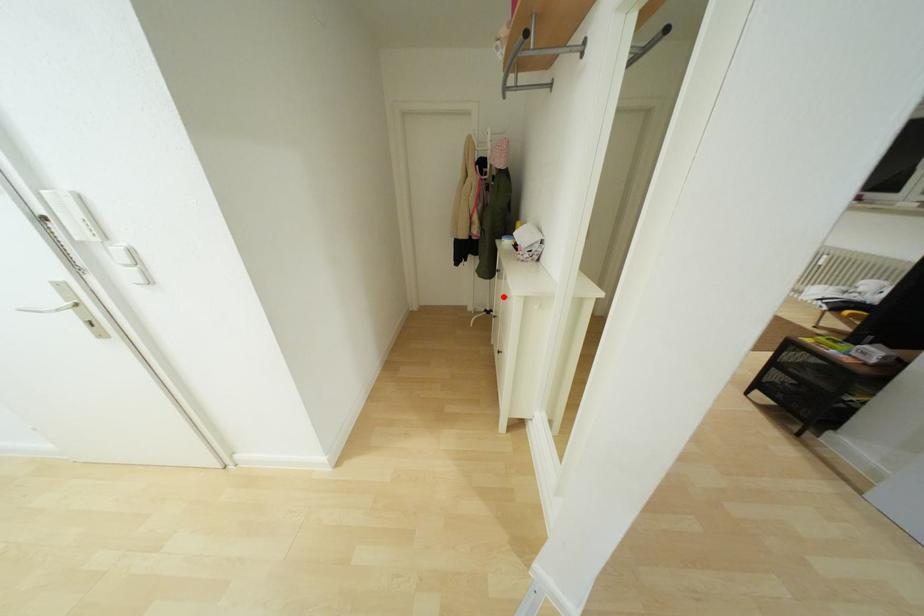
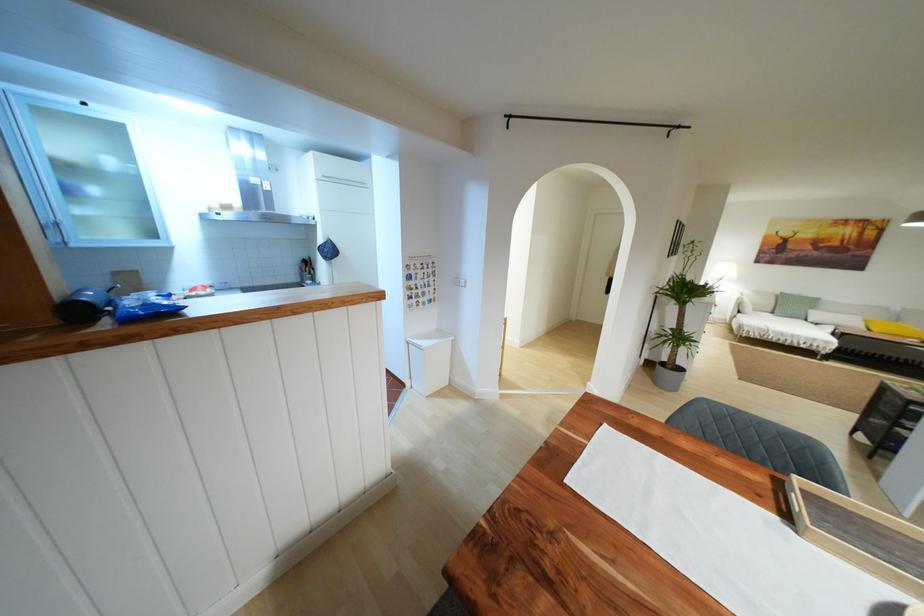
Question: I am providing you with two images of the same scene from different viewpoints. A red point is marked on the first image. At the location where the point appears in image 1, is it still visible in image 2?

Choices:
 (A) Yes
 (B) No

Answer: (B)